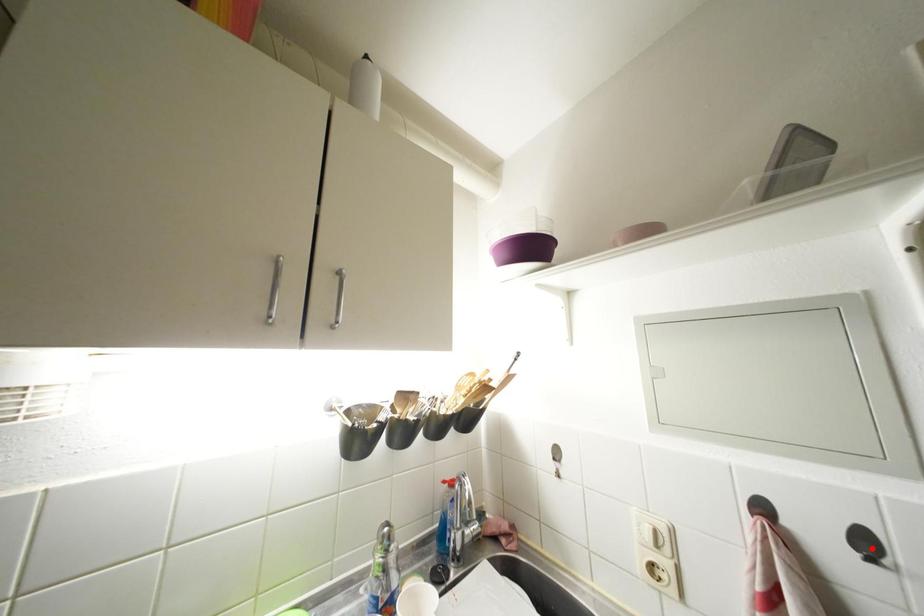
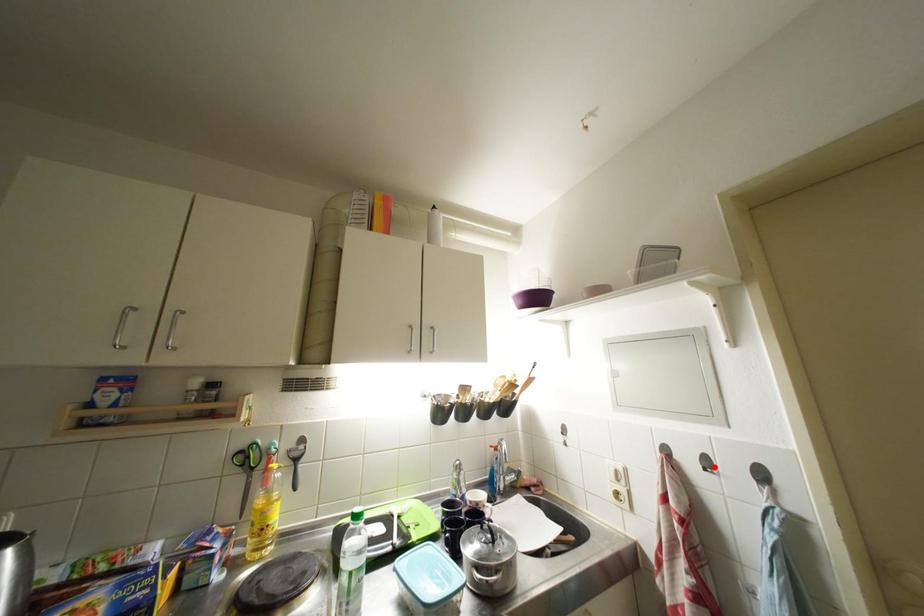
I am providing you with two images of the same scene from different viewpoints. A red point is marked on the first image and another point is marked on the second image. Are the points marked in image1 and image2 representing the same 3D position?

Yes